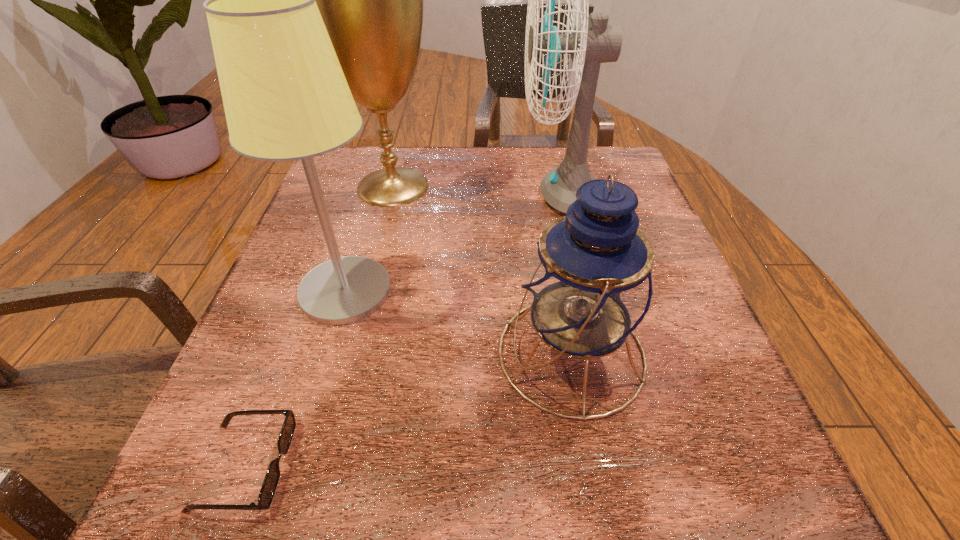
This screenshot has height=540, width=960. In the image, there is a desktop. Find the location of `vacant space at the far right corner`. vacant space at the far right corner is located at coordinates (611, 155).

Where is `free space between the shortest object and the fan`? The width and height of the screenshot is (960, 540). free space between the shortest object and the fan is located at coordinates (402, 330).

Locate an element on the screen. The width and height of the screenshot is (960, 540). vacant region between the second shortest object and the table lamp is located at coordinates (459, 322).

Where is `vacant region between the trophy cup and the shortest object`? The width and height of the screenshot is (960, 540). vacant region between the trophy cup and the shortest object is located at coordinates (319, 326).

The image size is (960, 540). Identify the location of vacant space that's between the shortest object and the table lamp. (296, 379).

Where is `vacant area that lies between the shortest object and the trophy cup`? Image resolution: width=960 pixels, height=540 pixels. vacant area that lies between the shortest object and the trophy cup is located at coordinates (319, 326).

The height and width of the screenshot is (540, 960). I want to click on free space between the trophy cup and the fan, so click(476, 191).

The image size is (960, 540). I want to click on vacant space that is in between the fan and the sunglasses, so click(402, 330).

Where is `free spot between the trophy cup and the fan`? The image size is (960, 540). free spot between the trophy cup and the fan is located at coordinates (476, 191).

This screenshot has height=540, width=960. In order to click on free space between the sunglasses and the second shortest object in this screenshot , I will do `click(408, 409)`.